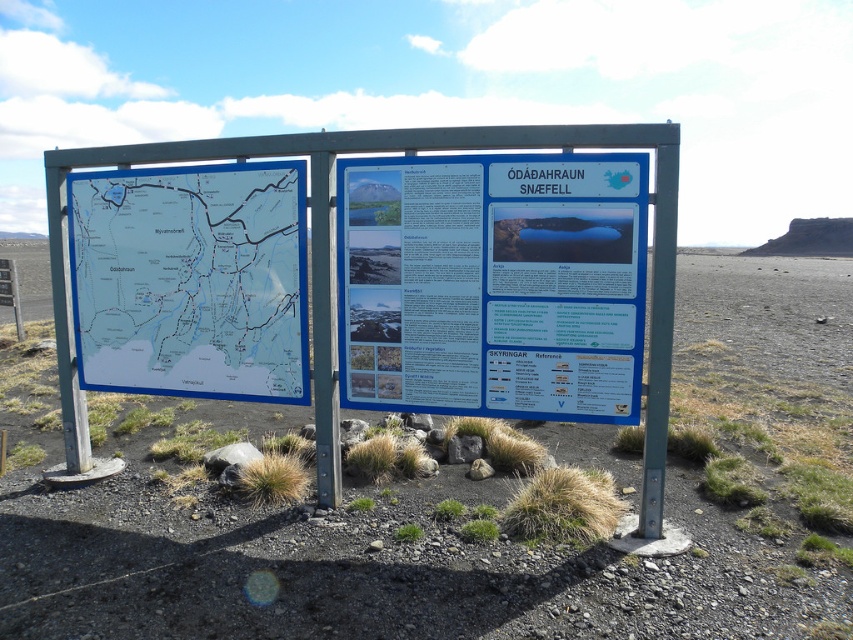
Based on the photo, you are a hiker trying to read the signboard. Which object, the white paper sign at center or the metallic pole at center, is positioned higher up?

The white paper sign at center is above the metallic pole at center, so it is positioned higher up.

You are a hiker trying to read the blue paper map at left and the metallic pole at center on the signboard. Which object is positioned higher up on the signboard?

The blue paper map at left is positioned higher up on the signboard than the metallic pole at center.

You are standing in front of the signboard and want to look at both the black gravel desert at center and the blue paper map at left. Which object will you need to look at first by moving closer to the signboard?

The black gravel desert at center is in front of the blue paper map at left, so you need to look at the black gravel desert at center first before moving closer to see the blue paper map at left.